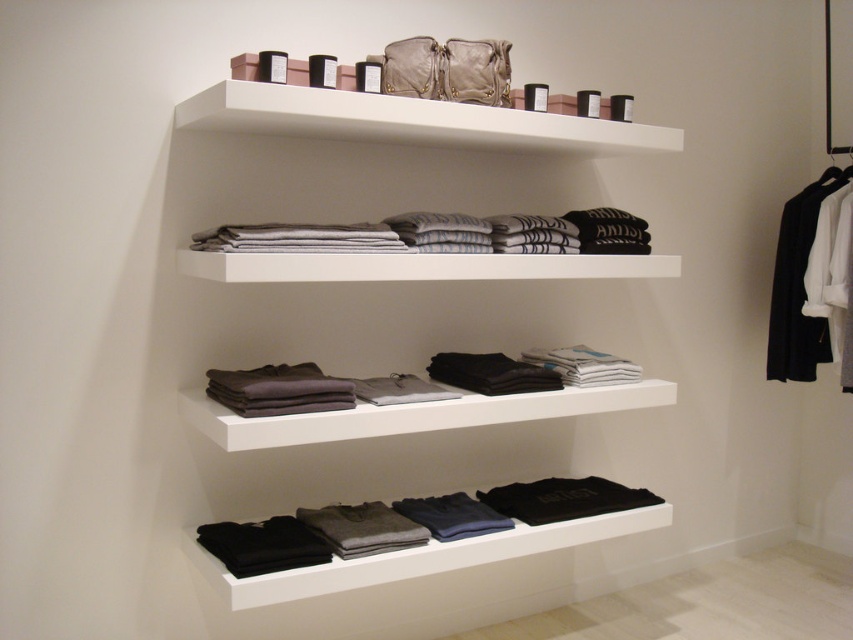
You are a customer looking at the middle shelf in the minimalist retail display. You see the dark gray fabric shirts at center and the dark gray fleece gloves at lower center. Which item is closer to you?

The dark gray fabric shirts at center are closer to you because they are positioned in front of the dark gray fleece gloves at lower center.

You are a store employee arranging items on the middle shelf. You have two items to place there, the dark gray fabric shirts at center and the dark gray fleece gloves at lower center. Which item requires more space on the shelf?

The dark gray fabric shirts at center requires more space on the shelf because it is bigger than the dark gray fleece gloves at lower center.